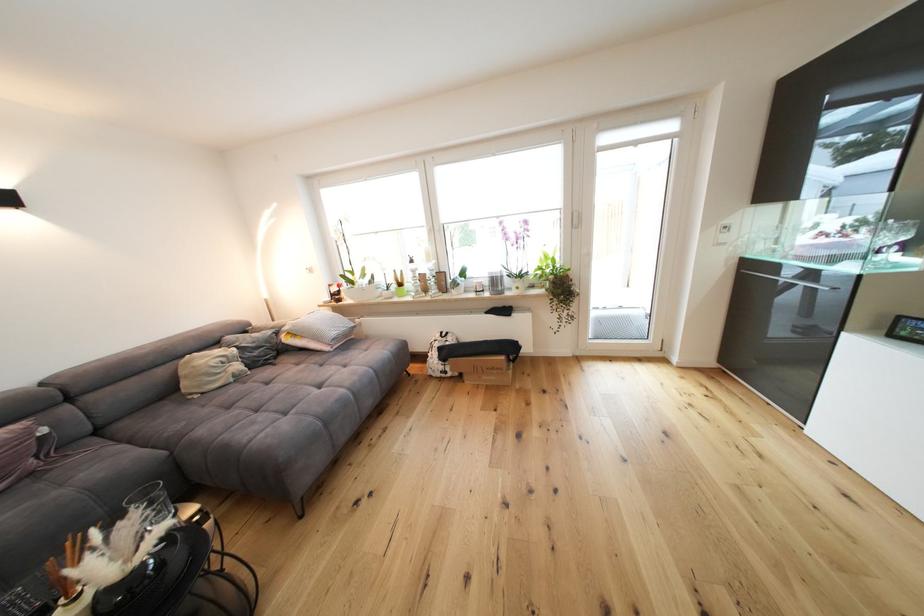
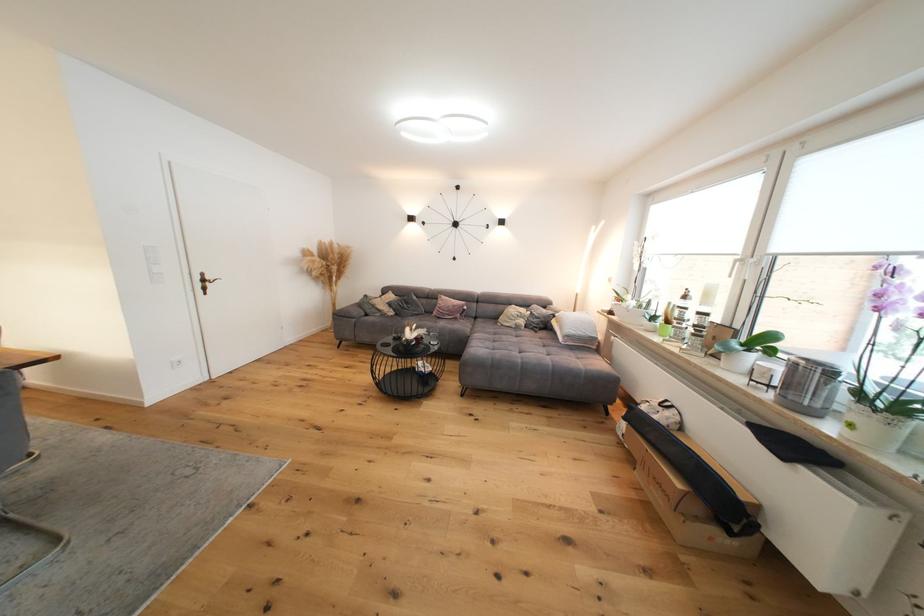
Locate, in the second image, the point that corresponds to (x=245, y=369) in the first image.

(529, 323)